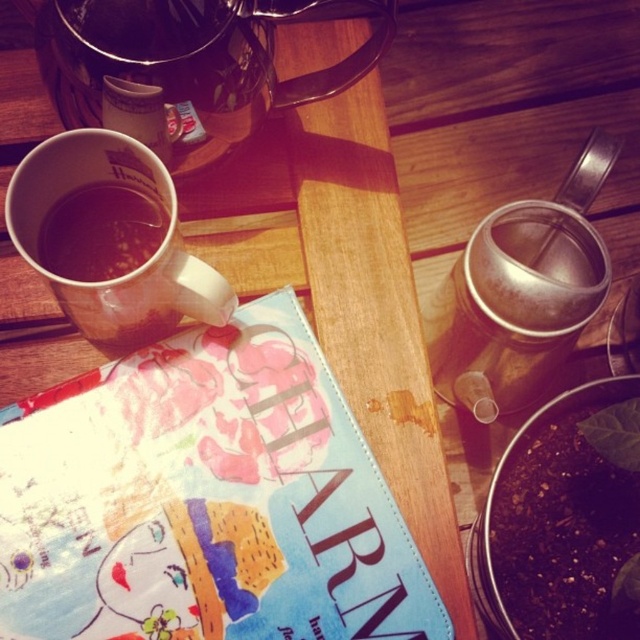
Question: Which of the following is the closest to the observer?

Choices:
 (A) (65, 208)
 (B) (212, 33)
 (C) (179, 291)

Answer: (B)

Question: Based on their relative distances, which object is nearer to the matte ceramic mug at left?

Choices:
 (A) brown matte cup at left
 (B) brushed metal teapot at upper left

Answer: (A)

Question: Is brushed metal teapot at upper left positioned before matte ceramic mug at left?

Choices:
 (A) yes
 (B) no

Answer: (B)

Question: Is brushed metal teapot at upper left positioned at the back of brown matte cup at left?

Choices:
 (A) no
 (B) yes

Answer: (A)

Question: Considering the relative positions of matte ceramic mug at left and brown matte cup at left in the image provided, where is matte ceramic mug at left located with respect to brown matte cup at left?

Choices:
 (A) left
 (B) right

Answer: (B)

Question: Which of the following is the farthest from the observer?

Choices:
 (A) brown matte cup at left
 (B) matte ceramic mug at left

Answer: (A)